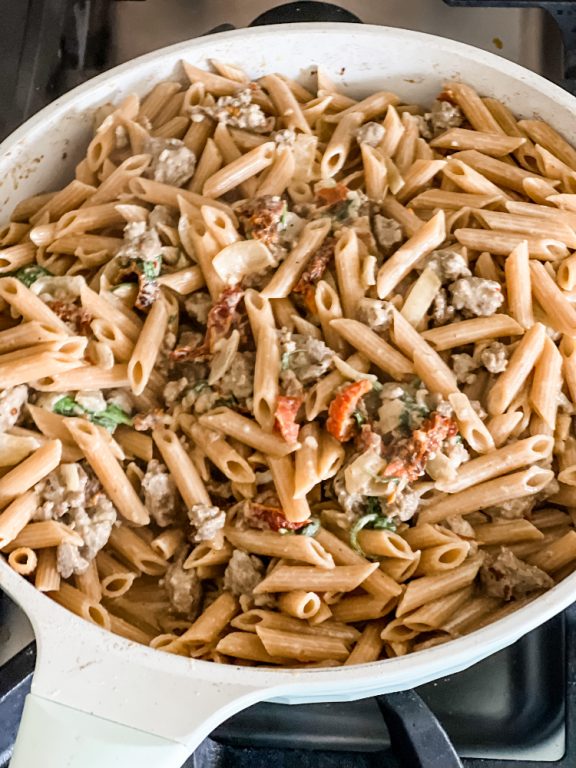
At what (x,y) coordinates should I click in order to perform the action: click on sides of pot. Please return your answer as a coordinate pair (x, y). This screenshot has width=576, height=768. Looking at the image, I should click on (472, 647), (83, 88), (509, 63).